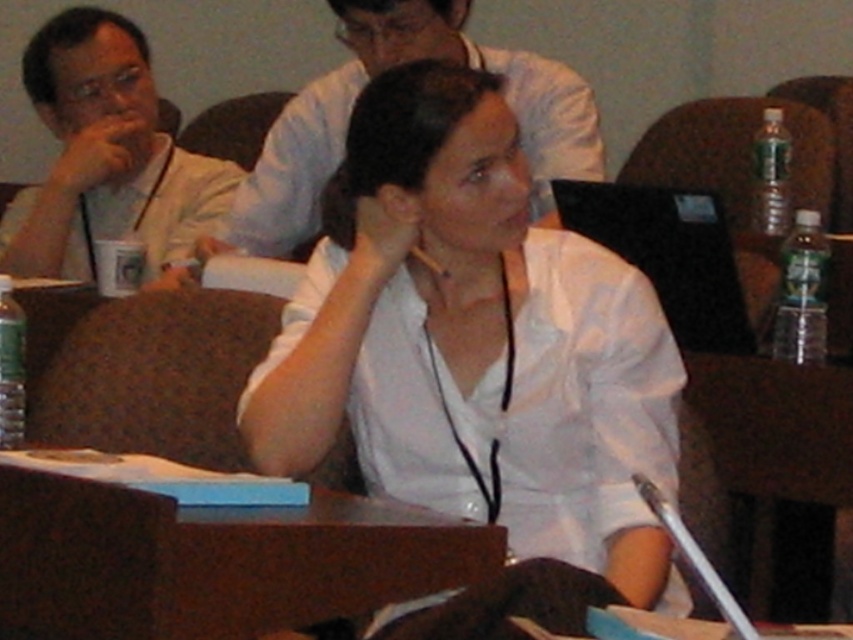
Does white matte shirt at center have a greater width compared to white shirt at upper center?

No, white matte shirt at center is not wider than white shirt at upper center.

Between point (575, 515) and point (288, 220), which one is positioned in front?

Positioned in front is point (575, 515).

Between point (438, 218) and point (251, 240), which one is positioned in front?

Point (438, 218) is more forward.

Where is `white matte shirt at center`? This screenshot has height=640, width=853. white matte shirt at center is located at coordinates (474, 342).

Based on the photo, between brown wood table at lower center and matte white shirt at left, which one has more height?

With more height is matte white shirt at left.

Is brown wood table at lower center closer to camera compared to matte white shirt at left?

Yes, brown wood table at lower center is closer to the viewer.

Who is more distant from viewer, (383, 593) or (123, 51)?

Positioned behind is point (123, 51).

This screenshot has width=853, height=640. Find the location of `brown wood table at lower center`. brown wood table at lower center is located at coordinates (213, 560).

Consider the image. Is brown wood table at lower center taller than white shirt at upper center?

In fact, brown wood table at lower center may be shorter than white shirt at upper center.

Is brown wood table at lower center to the right of white shirt at upper center from the viewer's perspective?

No, brown wood table at lower center is not to the right of white shirt at upper center.

The image size is (853, 640). Find the location of `brown wood table at lower center`. brown wood table at lower center is located at coordinates (213, 560).

The width and height of the screenshot is (853, 640). In order to click on brown wood table at lower center in this screenshot , I will do `click(213, 560)`.